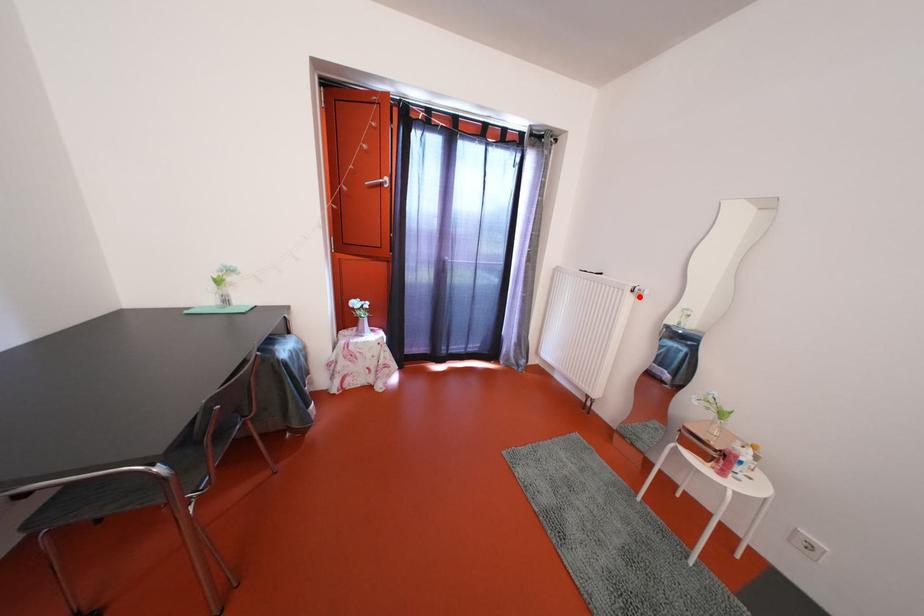
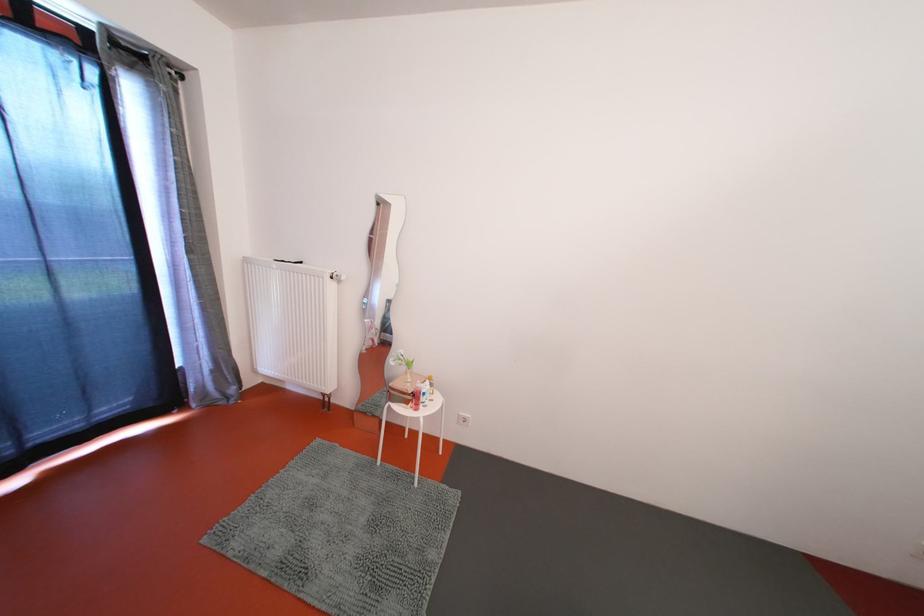
Question: I am providing you with two images of the same scene from different viewpoints. Given a red point in image1, look at the same physical point in image2. Is it:

Choices:
 (A) Closer to the viewpoint
 (B) Farther from the viewpoint

Answer: (A)